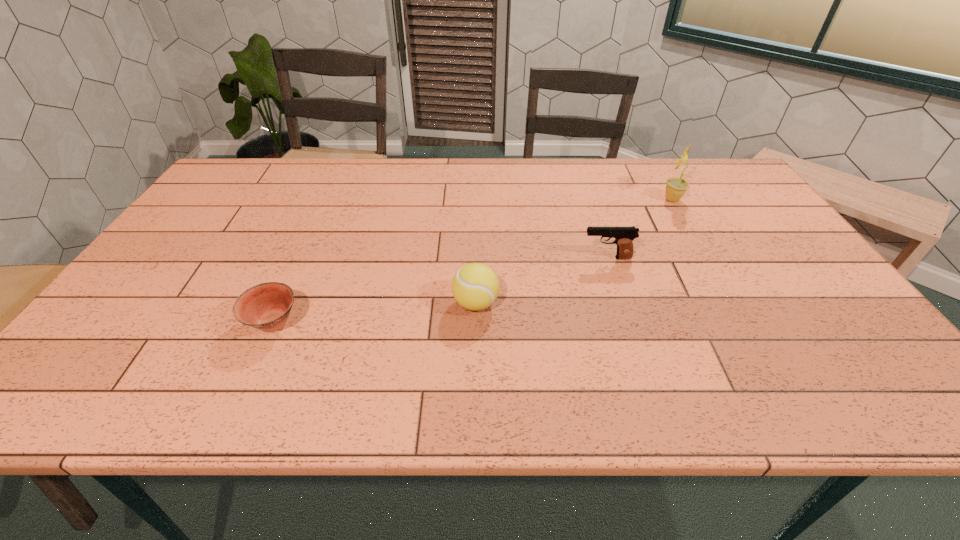
The width and height of the screenshot is (960, 540). What are the coordinates of `free space between the leftmost object and the tennis ball` in the screenshot? It's located at (374, 313).

This screenshot has height=540, width=960. I want to click on free point between the second object from left to right and the leftmost object, so click(x=374, y=313).

At what (x,y) coordinates should I click in order to perform the action: click on free point between the third object from left to right and the shortest object. Please return your answer as a coordinate pair (x, y). This screenshot has width=960, height=540. Looking at the image, I should click on pos(440,290).

Identify the location of free space between the pistol and the leftmost object. Image resolution: width=960 pixels, height=540 pixels. (440, 290).

I want to click on vacant region between the tennis ball and the farthest object, so click(x=574, y=251).

I want to click on vacant space that's between the pistol and the sunflower, so click(639, 228).

Identify the location of vacant point located between the shortest object and the tennis ball. The width and height of the screenshot is (960, 540). (374, 313).

This screenshot has height=540, width=960. In order to click on free point between the pistol and the tennis ball in this screenshot , I will do `click(541, 280)`.

Locate an element on the screen. empty space that is in between the farthest object and the bowl is located at coordinates (472, 261).

The image size is (960, 540). I want to click on free space between the pistol and the farthest object, so click(x=639, y=228).